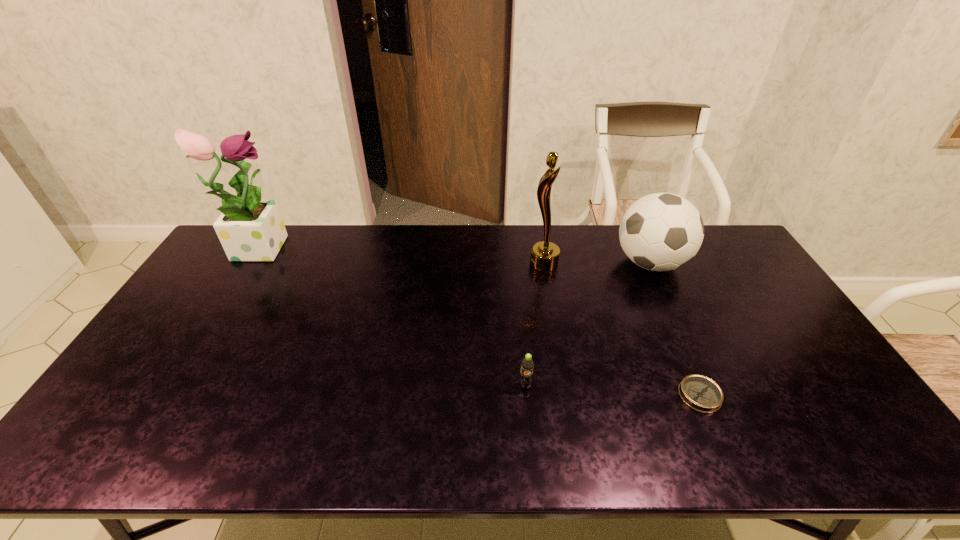
Identify the location of free space located on the right of the third tallest object. (705, 263).

I want to click on vacant position located 0.170m on the front label of the soda, so coord(532,454).

Identify the location of free space located 0.170m on the left of the compass. (612, 395).

You are a GUI agent. You are given a task and a screenshot of the screen. Output one action in this format:
    pyautogui.click(x=<x>, y=<y>)
    Task: Click on the flower arrangement that is at the far edge
    This screenshot has height=540, width=960.
    Given the screenshot: What is the action you would take?
    pyautogui.click(x=250, y=229)

Where is `award positioned at the far edge`? The height and width of the screenshot is (540, 960). award positioned at the far edge is located at coordinates (544, 256).

Identify the location of soccer ball that is positioned at the far edge. The image size is (960, 540). (662, 231).

Find the location of a particular element. The width and height of the screenshot is (960, 540). object that is at the left edge is located at coordinates (250, 229).

Where is `object at the far left corner`? This screenshot has height=540, width=960. object at the far left corner is located at coordinates (250, 229).

Image resolution: width=960 pixels, height=540 pixels. I want to click on vacant space at the far edge of the desktop, so click(x=334, y=247).

What are the coordinates of `free spot at the near edge of the desktop` in the screenshot? It's located at (228, 450).